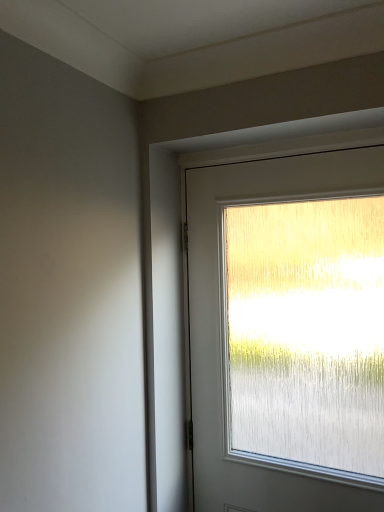
You are a GUI agent. You are given a task and a screenshot of the screen. Output one action in this format:
    pyautogui.click(x=<x>, y=<y>)
    Task: Click on the frosted glass window at upper right
    This screenshot has height=512, width=384.
    Given the screenshot: What is the action you would take?
    pyautogui.click(x=222, y=328)

What do you see at coordinates (222, 328) in the screenshot? I see `frosted glass window at upper right` at bounding box center [222, 328].

At what (x,y) coordinates should I click in order to perform the action: click on frosted glass window at upper right. Please return your answer as a coordinate pair (x, y). The width and height of the screenshot is (384, 512). Looking at the image, I should click on (222, 328).